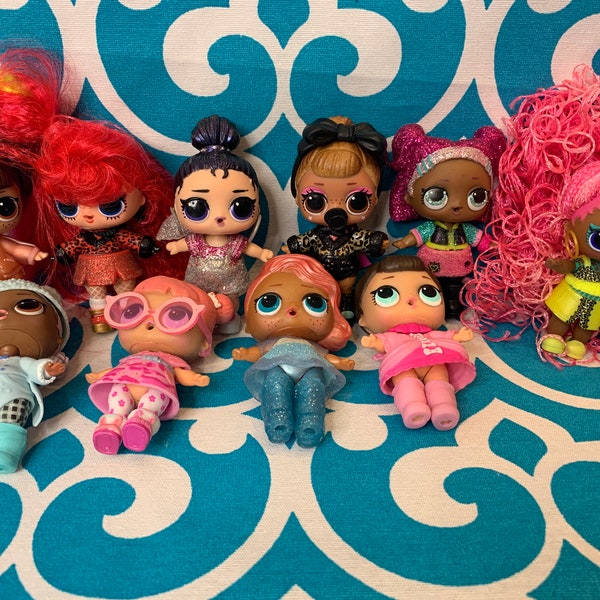
Identify the location of dolls. The height and width of the screenshot is (600, 600). (92, 207), (22, 201), (20, 324), (173, 324), (226, 210), (336, 205), (288, 310), (395, 308), (453, 196), (574, 292).